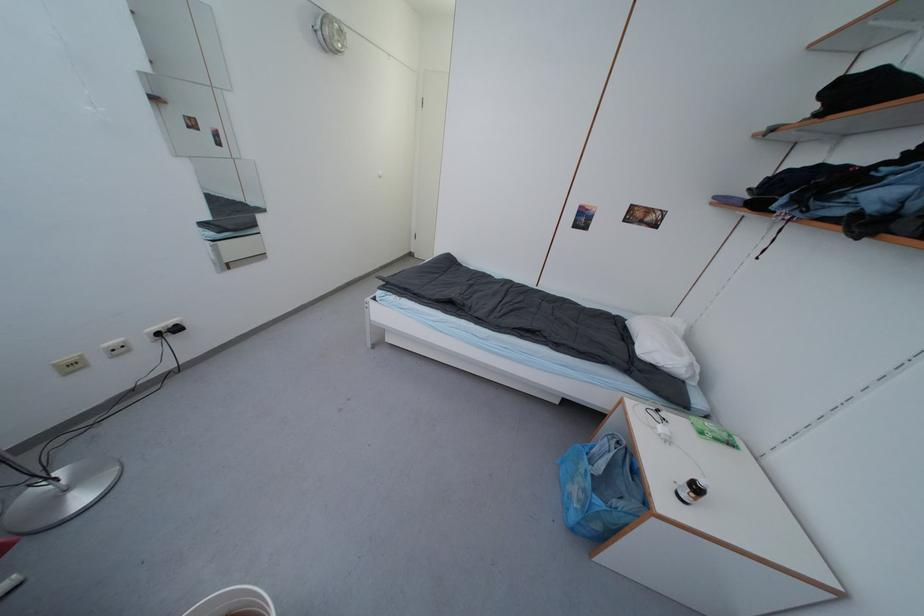
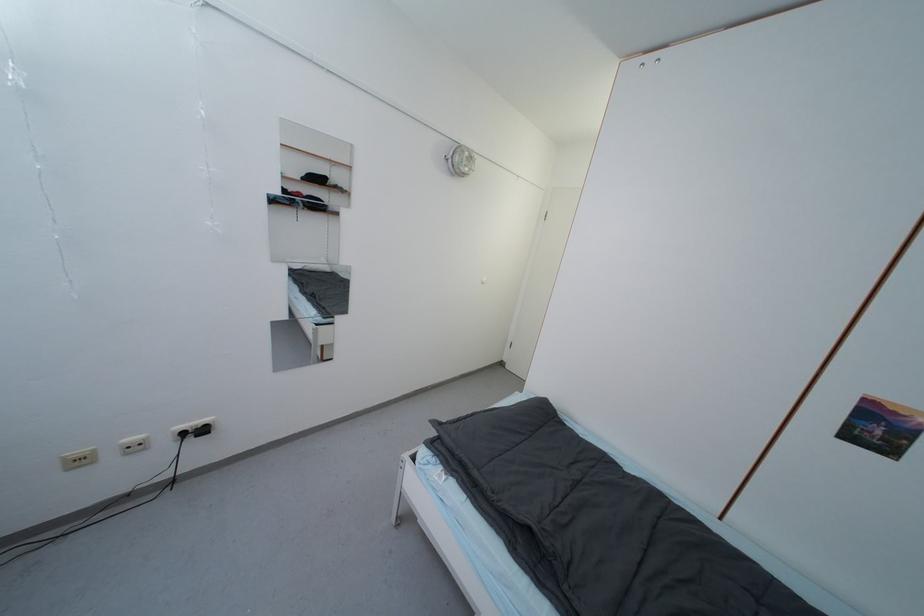
Locate, in the second image, the point that corresponds to (78,369) in the first image.

(83, 464)